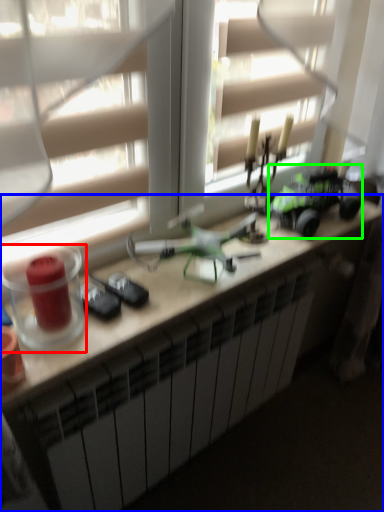
Question: Considering the real-world distances, which object is farthest from candle holder (highlighted by a red box)? desk (highlighted by a blue box) or model car (highlighted by a green box)?

Choices:
 (A) desk
 (B) model car

Answer: (B)